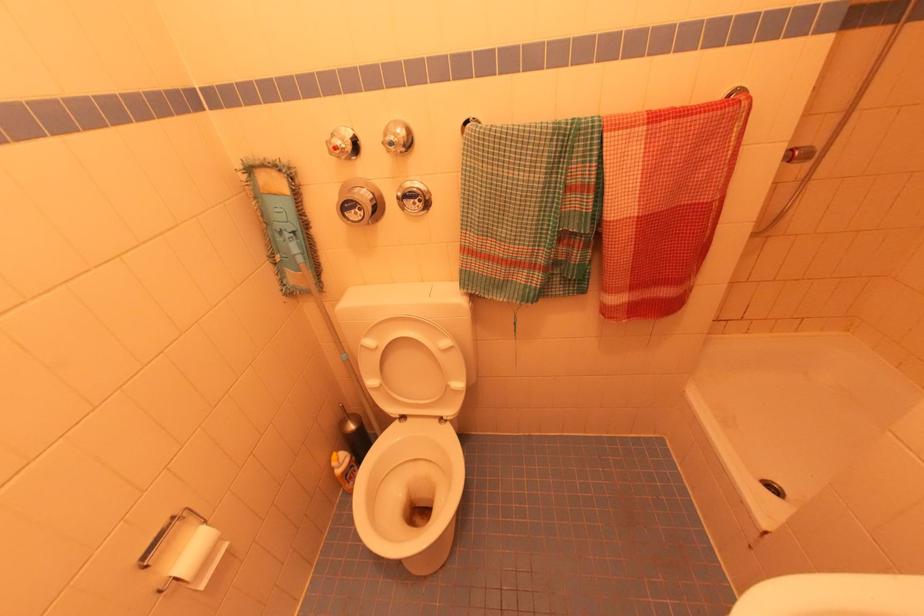
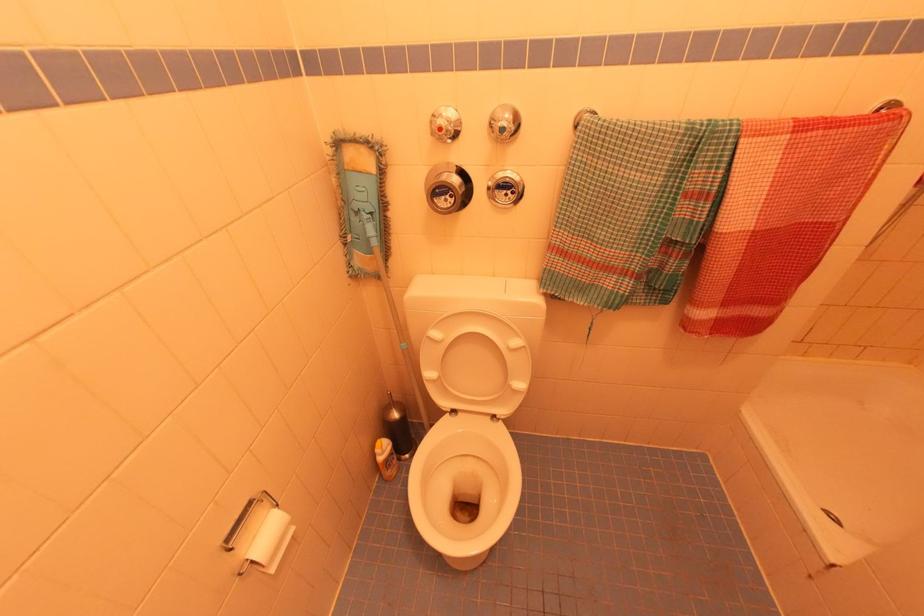
Question: I am providing you with two images of the same scene from different viewpoints. Please identify which objects are invisible in image2.

Choices:
 (A) silver shower knob
 (B) metal towel bar
 (C) yellow cleaner bottle
 (D) none of these

Answer: (D)